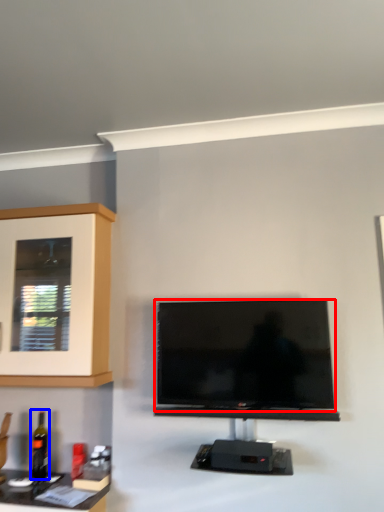
Question: Which object is further to the camera taking this photo, television (highlighted by a red box) or bottle (highlighted by a blue box)?

Choices:
 (A) television
 (B) bottle

Answer: (B)